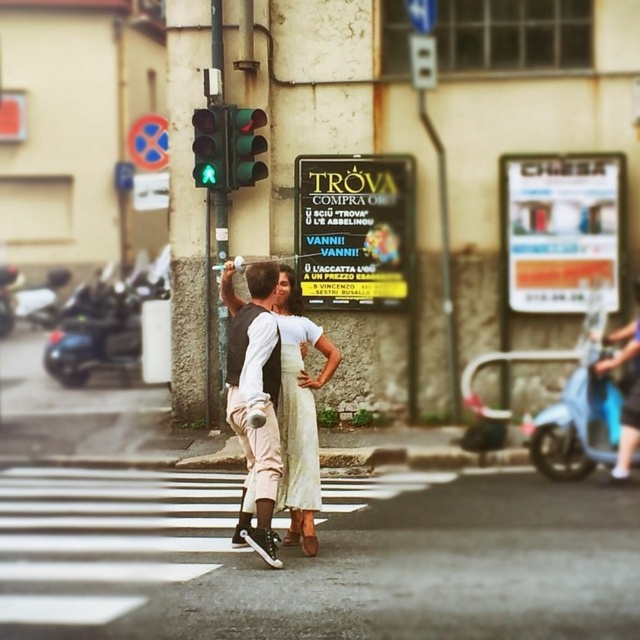
Is matte black vest at center above green glass traffic light at upper center?

Incorrect, matte black vest at center is not positioned above green glass traffic light at upper center.

Does point (266, 280) come in front of point (262, 148)?

Yes, point (266, 280) is closer to viewer.

Find the location of a particular element. This screenshot has width=640, height=640. matte black vest at center is located at coordinates (253, 401).

Where is `matte black vest at center`? The width and height of the screenshot is (640, 640). matte black vest at center is located at coordinates (253, 401).

Can you confirm if light beige fabric dress at center is smaller than metallic pole at center?

Incorrect, light beige fabric dress at center is not smaller in size than metallic pole at center.

Consider the image. Which of these two, light beige fabric dress at center or metallic pole at center, stands shorter?

Standing shorter between the two is metallic pole at center.

This screenshot has height=640, width=640. I want to click on light beige fabric dress at center, so click(300, 412).

Between point (228, 129) and point (221, 140), which one is positioned in front?

Point (221, 140)

Does green glass traffic light at upper center have a greater width compared to green glass pedestrian signal at upper center?

Yes.

Does point (260, 148) come farther from viewer compared to point (211, 144)?

That is False.

The width and height of the screenshot is (640, 640). I want to click on green glass traffic light at upper center, so click(x=244, y=147).